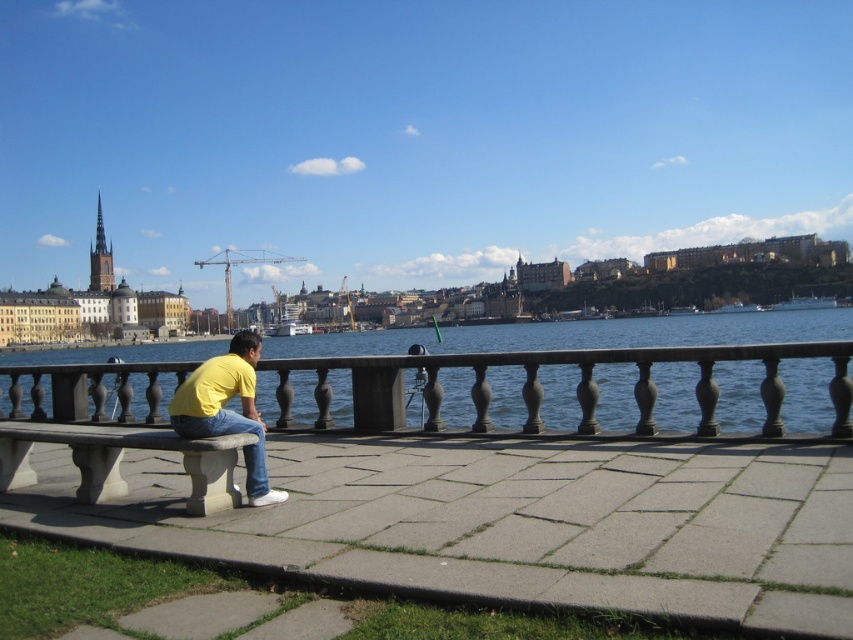
Looking at this image, you are a photographer standing on the riverside walkway. You want to capture a photo where the blue water at center and yellow matte shirt at center are both visible. Based on their relative heights, which object will appear larger in the photo?

The blue water at center will appear larger in the photo because it has a greater height compared to the yellow matte shirt at center.

You are standing at the point marked by the coordinates point (596, 352). What is the color of the surface you are currently standing on?

The point (596, 352) marks blue water at center, so the surface you are standing on is blue water.

You are a photographer trying to capture the blue water at center and the yellow matte shirt at center in the same frame. Which object should you zoom in on to ensure both are visible without moving your position?

You should zoom in on the yellow matte shirt at center because the blue water at center is wider than the yellow matte shirt at center, so focusing on the smaller object allows both to fit in the frame.